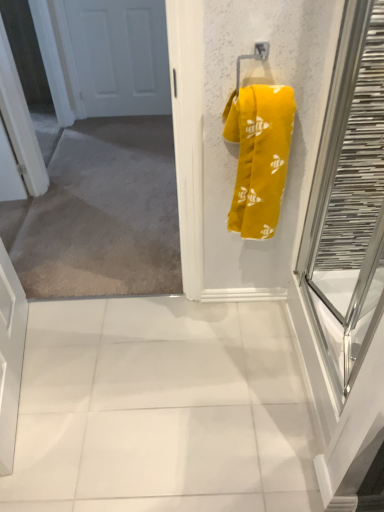
Locate an element on the screen. The image size is (384, 512). free area below clear glass door at right (from a real-world perspective) is located at coordinates (327, 322).